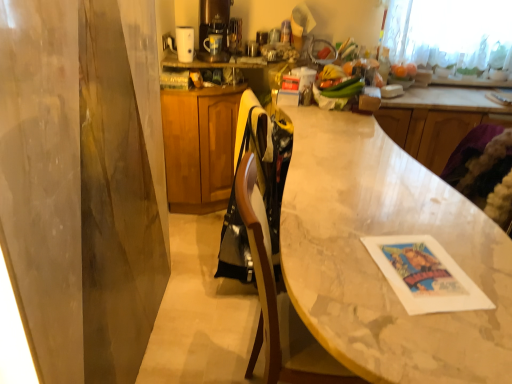
Question: Does satin gold coffee machine at upper center have a larger size compared to wooden counter at upper right?

Choices:
 (A) no
 (B) yes

Answer: (A)

Question: Is satin gold coffee machine at upper center not close to wooden counter at upper right?

Choices:
 (A) yes
 (B) no

Answer: (A)

Question: Is satin gold coffee machine at upper center facing away from wooden counter at upper right?

Choices:
 (A) no
 (B) yes

Answer: (A)

Question: Considering the relative sizes of satin gold coffee machine at upper center and wooden counter at upper right in the image provided, is satin gold coffee machine at upper center shorter than wooden counter at upper right?

Choices:
 (A) no
 (B) yes

Answer: (B)

Question: Does satin gold coffee machine at upper center lie behind wooden counter at upper right?

Choices:
 (A) no
 (B) yes

Answer: (A)

Question: From the image's perspective, is satin gold coffee machine at upper center below wooden counter at upper right?

Choices:
 (A) yes
 (B) no

Answer: (B)

Question: Is white glossy coffee cup at upper center completely or partially outside of smooth orange fruit at upper right?

Choices:
 (A) yes
 (B) no

Answer: (A)

Question: Does white glossy coffee cup at upper center come behind smooth orange fruit at upper right?

Choices:
 (A) yes
 (B) no

Answer: (B)

Question: Is white glossy coffee cup at upper center not near smooth orange fruit at upper right?

Choices:
 (A) no
 (B) yes

Answer: (B)

Question: Are white glossy coffee cup at upper center and smooth orange fruit at upper right making contact?

Choices:
 (A) yes
 (B) no

Answer: (B)

Question: Is white glossy coffee cup at upper center oriented towards smooth orange fruit at upper right?

Choices:
 (A) no
 (B) yes

Answer: (A)

Question: Can you confirm if white glossy coffee cup at upper center is positioned to the left of smooth orange fruit at upper right?

Choices:
 (A) no
 (B) yes

Answer: (B)

Question: Does wooden counter at upper right come in front of smooth orange fruit at upper right?

Choices:
 (A) yes
 (B) no

Answer: (A)